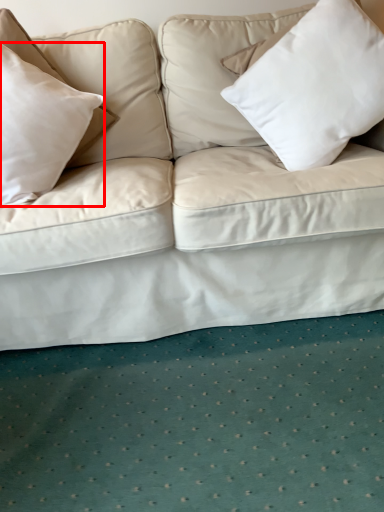
Question: From the image's perspective, what is the correct spatial positioning of pillow (annotated by the red box) in reference to pillow?

Choices:
 (A) below
 (B) above

Answer: (A)